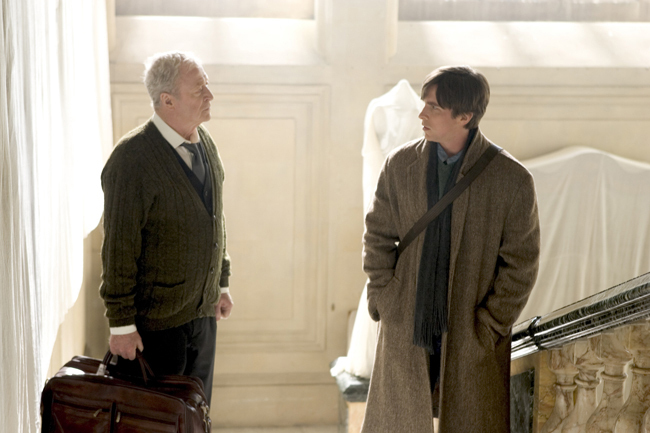
Locate an element on the screen. decorative staircase pillars is located at coordinates (559, 400), (582, 402), (608, 388), (641, 402).